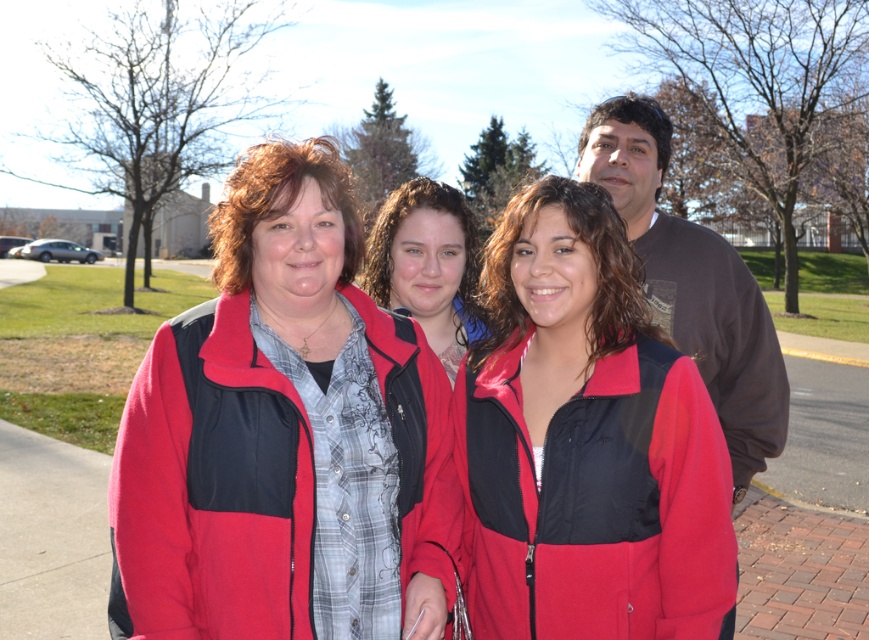
You are a photographer trying to capture a group photo of the red fleece jacket at center and the dark gray cotton shirt at upper right. You want to ensure both subjects are in focus. Which subject should you focus on first to ensure proper depth of field?

The red fleece jacket at center should be focused on first because it has a lesser height compared to the dark gray cotton shirt at upper right, so it is closer to the camera. Proper depth of field requires focusing on the closer subject to ensure both are in focus.

You are trying to decide which jacket to wear for a cold day. You see both the matte fleece jacket at center and the matte black jacket at center in the image. Which one is wider?

The matte fleece jacket at center is wider than the matte black jacket at center according to the description.

You are a photographer setting up for a group photo. You have two jackets, a matte fleece jacket at center and a matte black jacket at center, that need to be placed exactly 3 feet apart. Can you position them according to the current spacing between these two jackets in the image?

The distance between the matte fleece jacket at center and the matte black jacket at center is 33.20 inches, which is approximately 2.77 feet. Since 2.77 feet is less than 3 feet, the jackets are currently closer than the required distance. To meet the 3 feet requirement, you would need to increase the spacing between them by about 0.23 feet.